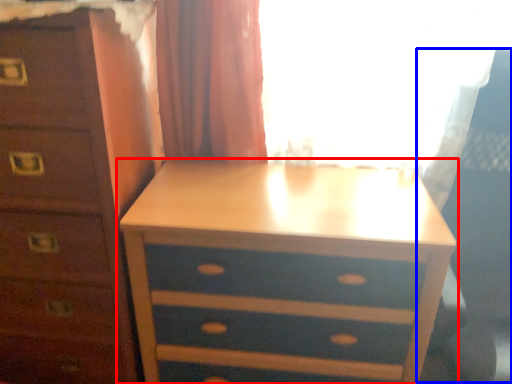
Question: Which object is closer to the camera taking this photo, nightstand (highlighted by a red box) or swivel chair (highlighted by a blue box)?

Choices:
 (A) nightstand
 (B) swivel chair

Answer: (B)